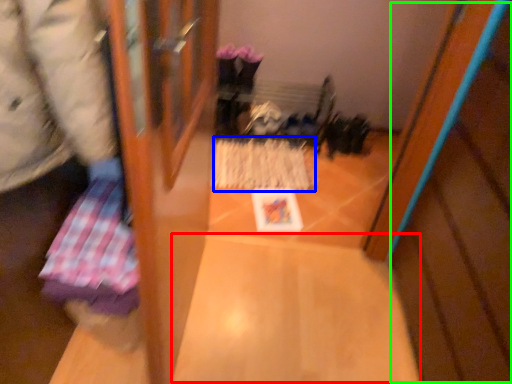
Question: Which is farther away from wide (highlighted by a red box)? wrapping paper (highlighted by a blue box) or wood (highlighted by a green box)?

Choices:
 (A) wrapping paper
 (B) wood

Answer: (A)